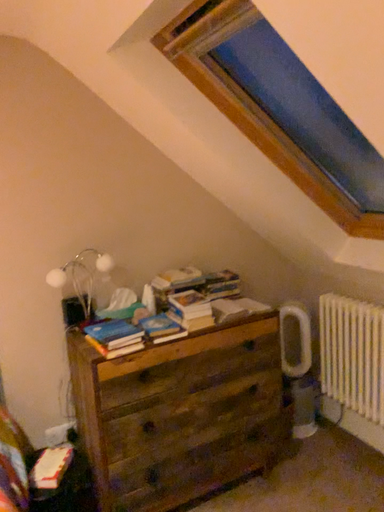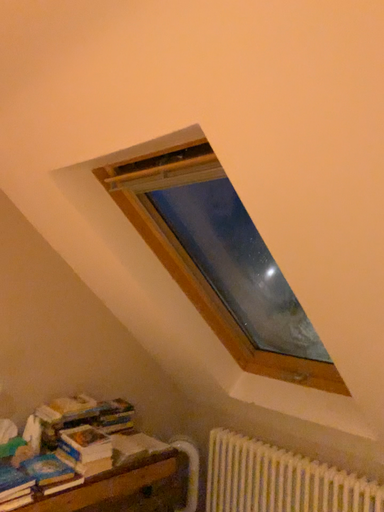
Question: How did the camera likely rotate when shooting the video?

Choices:
 (A) rotated right
 (B) rotated left

Answer: (A)